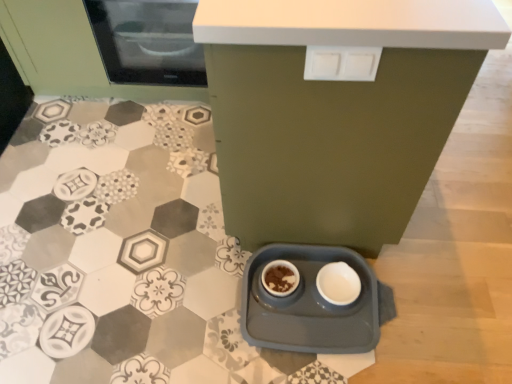
Question: Is the position of matte black microwave at upper left less distant than that of white glossy bowl at lower center?

Choices:
 (A) yes
 (B) no

Answer: (B)

Question: From a real-world perspective, is matte black microwave at upper left beneath white glossy bowl at lower center?

Choices:
 (A) no
 (B) yes

Answer: (A)

Question: Is there a large distance between matte black microwave at upper left and white glossy bowl at lower center?

Choices:
 (A) yes
 (B) no

Answer: (A)

Question: From a real-world perspective, is matte black microwave at upper left physically above white glossy bowl at lower center?

Choices:
 (A) no
 (B) yes

Answer: (B)

Question: Can you confirm if matte black microwave at upper left is wider than white glossy bowl at lower center?

Choices:
 (A) no
 (B) yes

Answer: (B)

Question: Is white plastic drawer at upper center inside the boundaries of matte ceramic bowl at center, or outside?

Choices:
 (A) inside
 (B) outside

Answer: (B)

Question: From a real-world perspective, is white plastic drawer at upper center physically located above or below matte ceramic bowl at center?

Choices:
 (A) below
 (B) above

Answer: (B)

Question: In the image, is white plastic drawer at upper center positioned in front of or behind matte ceramic bowl at center?

Choices:
 (A) front
 (B) behind

Answer: (A)

Question: Considering the positions of white plastic drawer at upper center and matte ceramic bowl at center in the image, is white plastic drawer at upper center bigger or smaller than matte ceramic bowl at center?

Choices:
 (A) small
 (B) big

Answer: (A)

Question: In terms of width, does white glossy bowl at lower center look wider or thinner when compared to matte black microwave at upper left?

Choices:
 (A) wide
 (B) thin

Answer: (B)

Question: Does point (321, 286) appear closer or farther from the camera than point (155, 8)?

Choices:
 (A) farther
 (B) closer

Answer: (B)

Question: Is white glossy bowl at lower center to the left or to the right of matte black microwave at upper left in the image?

Choices:
 (A) right
 (B) left

Answer: (A)

Question: Based on their sizes in the image, would you say white glossy bowl at lower center is bigger or smaller than matte black microwave at upper left?

Choices:
 (A) big
 (B) small

Answer: (B)

Question: Considering the positions of point (93, 29) and point (344, 54), is point (93, 29) closer or farther from the camera than point (344, 54)?

Choices:
 (A) farther
 (B) closer

Answer: (A)

Question: From the image's perspective, relative to white plastic drawer at upper center, is matte black microwave at upper left above or below?

Choices:
 (A) above
 (B) below

Answer: (A)